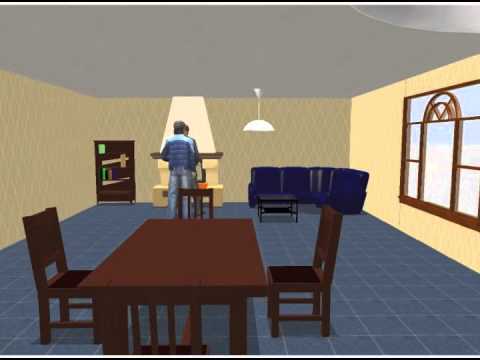
The width and height of the screenshot is (480, 360). In order to click on chair in this screenshot , I will do `click(43, 273)`.